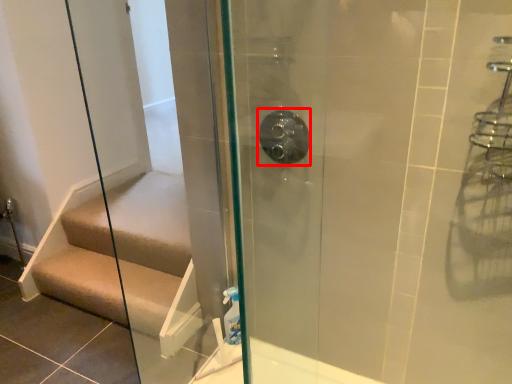
Question: From the image, what is the correct spatial relationship of shower (annotated by the red box) in relation to stairs?

Choices:
 (A) left
 (B) right

Answer: (B)